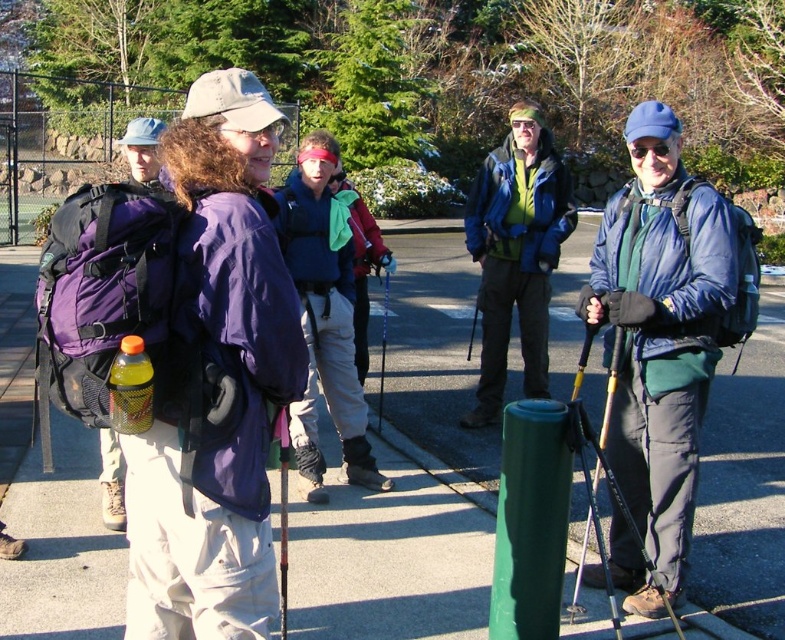
You are a hiker who wants to locate the matte blue jacket at center and the yellow metallic ski pole at lower center in the scene. Based on their positions, which object is closer to the right edge of the image?

The matte blue jacket at center is closer to the right edge of the image because it is positioned to the right of the yellow metallic ski pole at lower center.

You are a photographer trying to capture a wide shot of the matte blue jacket at center and the yellow metallic ski pole at lower center. Given their sizes, which object will appear bigger in your photo?

The matte blue jacket at center will appear bigger in the photo because its width is larger than that of the yellow metallic ski pole at lower center.